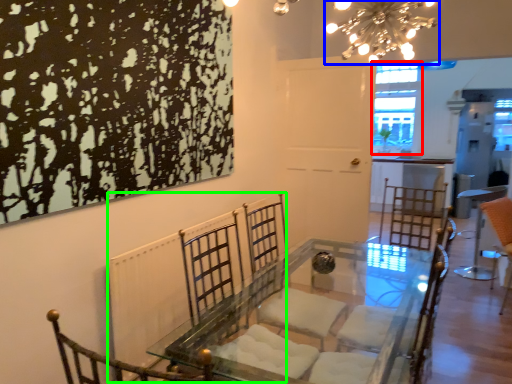
Question: Considering the real-world distances, which object is farthest from window (highlighted by a red box)? light fixture (highlighted by a blue box) or radiator (highlighted by a green box)?

Choices:
 (A) light fixture
 (B) radiator

Answer: (B)